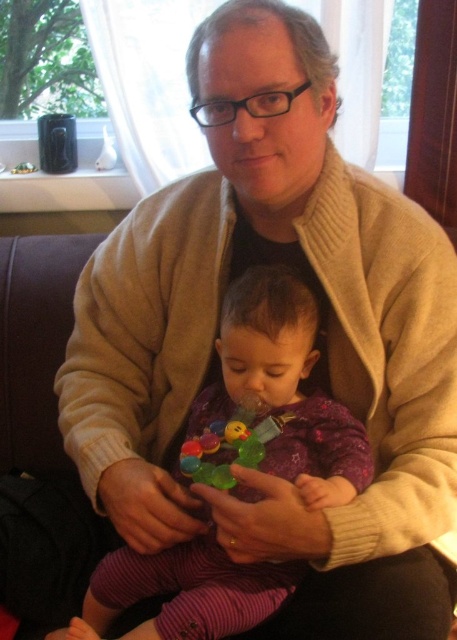
Question: Which object is positioned closest to the rubber teething ring at center?

Choices:
 (A) translucent plastic toy at center
 (B) purple fleece baby at center

Answer: (A)

Question: Which point is closer to the camera taking this photo?

Choices:
 (A) (201, 458)
 (B) (228, 419)

Answer: (A)

Question: Among these points, which one is farthest from the camera?

Choices:
 (A) (228, 547)
 (B) (330, 486)

Answer: (A)

Question: Is the position of purple fleece baby at center more distant than that of rubber teething ring at center?

Choices:
 (A) yes
 (B) no

Answer: (B)

Question: Is purple fleece baby at center below rubber teething ring at center?

Choices:
 (A) no
 (B) yes

Answer: (A)

Question: Does translucent plastic toy at center lie behind rubber teething ring at center?

Choices:
 (A) no
 (B) yes

Answer: (B)